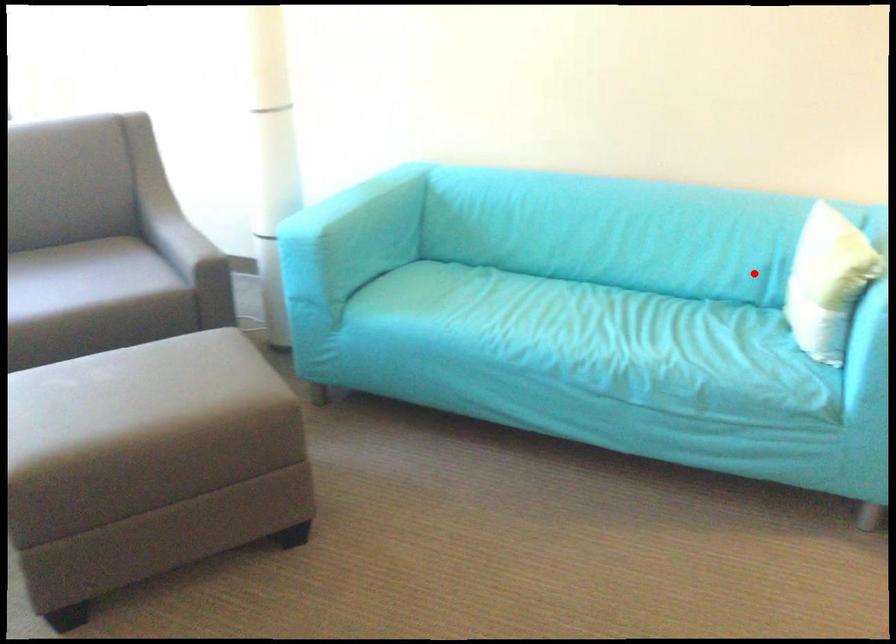
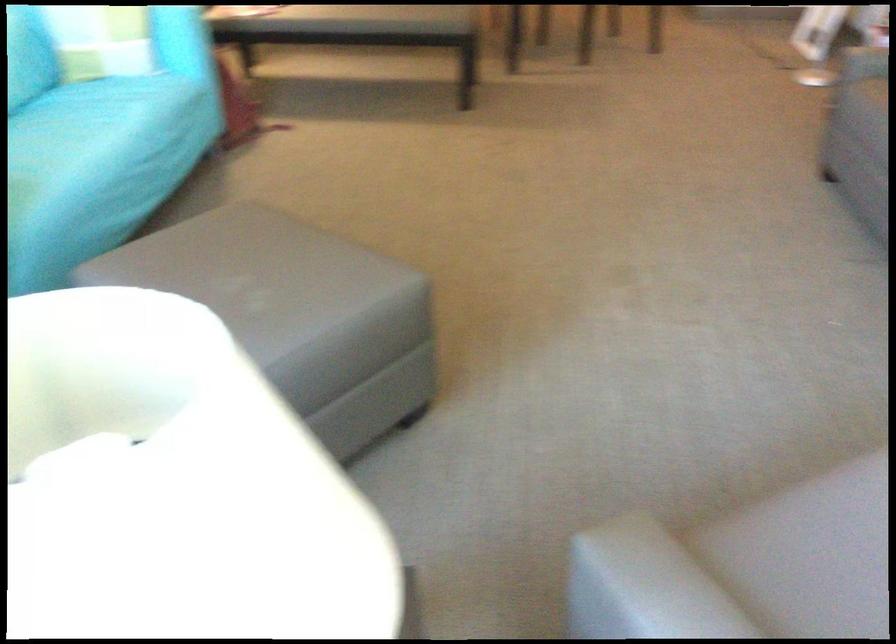
Question: I am providing you with two images of the same scene from different viewpoints. Image1 has a red point marked. In image2, the corresponding 3D location appears at what relative position? Reply with the corresponding letter.

Choices:
 (A) Closer
 (B) Farther

Answer: (B)